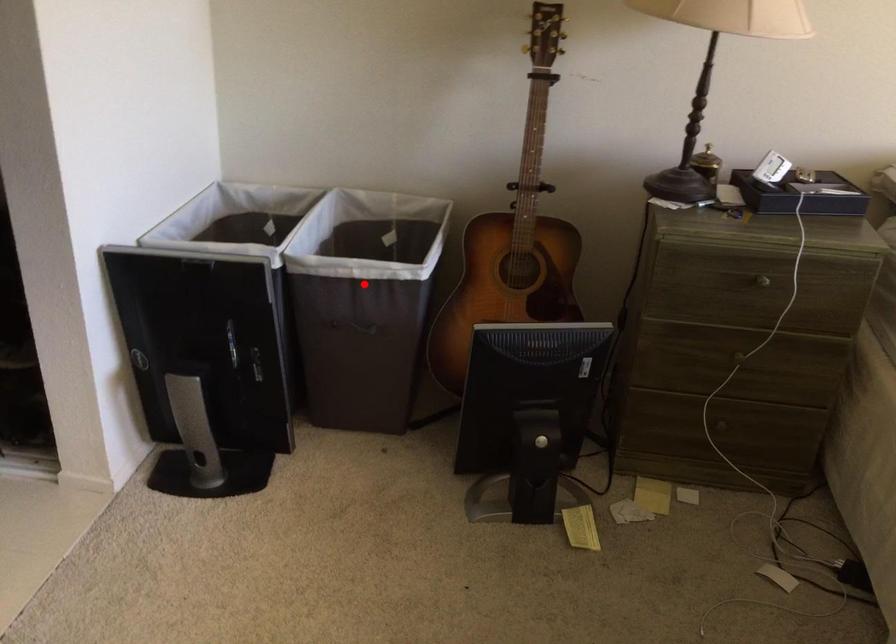
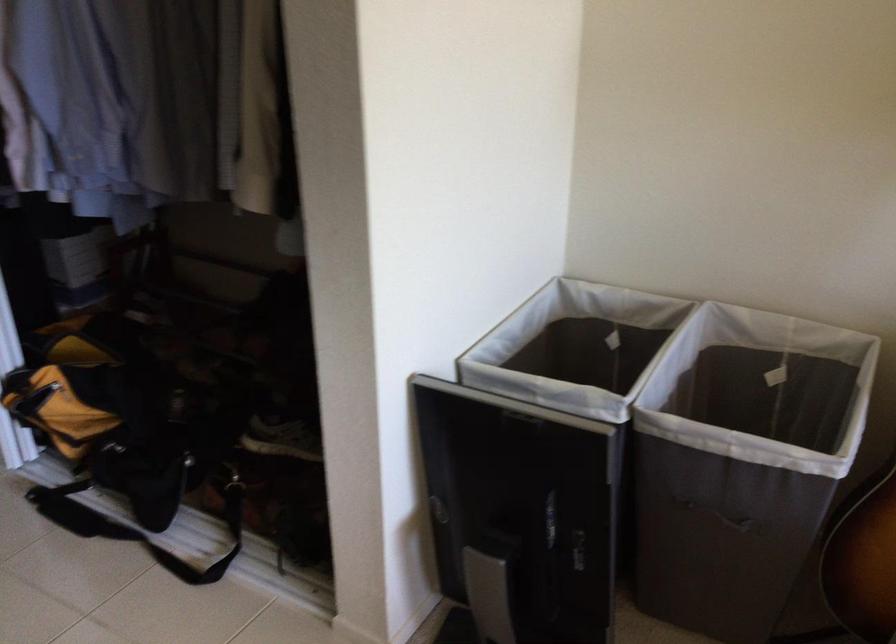
Question: I am providing you with two images of the same scene from different viewpoints. Image1 has a red point marked. In image2, the corresponding 3D location appears at what relative position? Reply with the corresponding letter.

Choices:
 (A) Closer
 (B) Farther

Answer: (A)